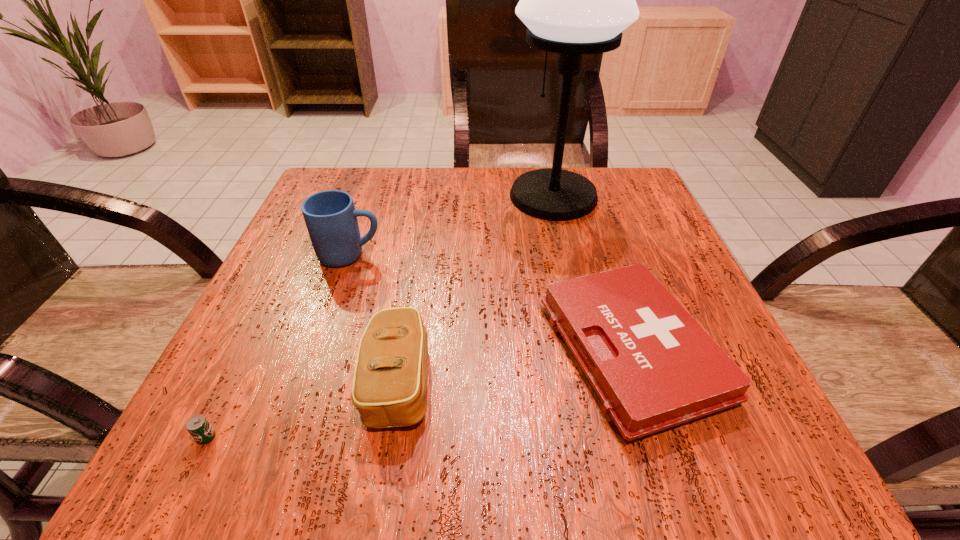
Image resolution: width=960 pixels, height=540 pixels. I want to click on the farthest object, so click(575, 0).

The width and height of the screenshot is (960, 540). Find the location of `the tallest object`. the tallest object is located at coordinates (575, 0).

Locate an element on the screen. This screenshot has height=540, width=960. the fourth shortest object is located at coordinates (331, 219).

At what (x,y) coordinates should I click in order to perform the action: click on mug. Please return your answer as a coordinate pair (x, y). The height and width of the screenshot is (540, 960). Looking at the image, I should click on (331, 219).

Identify the location of clutch bag. (389, 389).

Find the location of `the third tallest object`. the third tallest object is located at coordinates (389, 389).

You are a GUI agent. You are given a task and a screenshot of the screen. Output one action in this format:
    pyautogui.click(x=<x>, y=<y>)
    Task: Click on the first-aid kit
    Image resolution: width=960 pixels, height=540 pixels.
    Given the screenshot: What is the action you would take?
    pyautogui.click(x=652, y=366)

This screenshot has width=960, height=540. What are the coordinates of `the leftmost object` in the screenshot? It's located at click(x=198, y=426).

Locate an element on the screen. Image resolution: width=960 pixels, height=540 pixels. the shortest object is located at coordinates (198, 426).

Where is `free space located 0.230m on the left of the farthest object`? free space located 0.230m on the left of the farthest object is located at coordinates (406, 197).